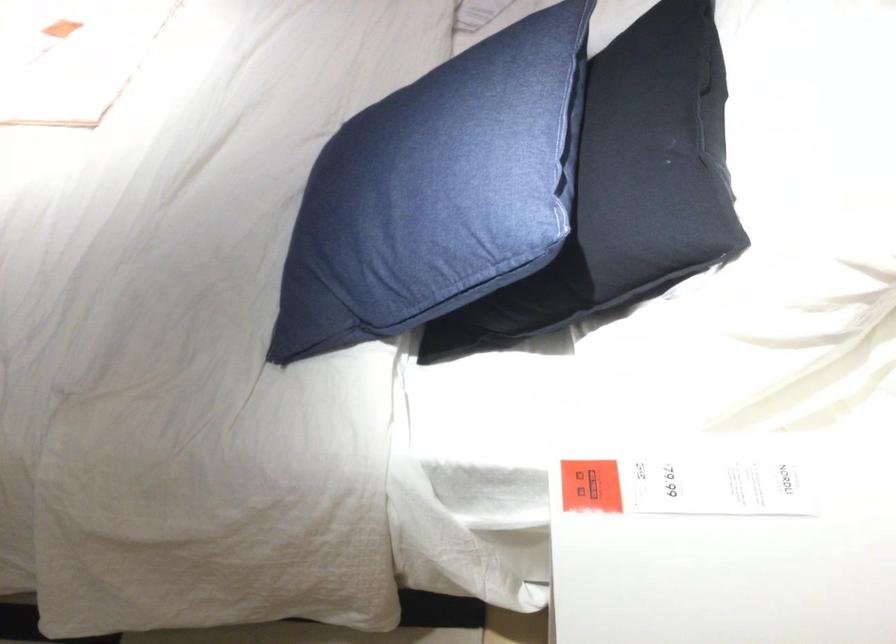
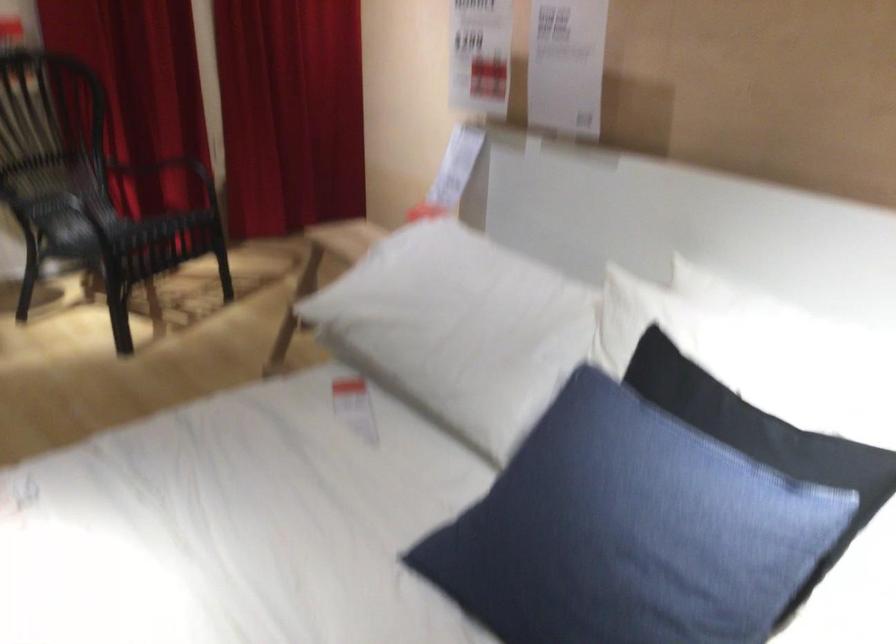
Locate, in the second image, the point that corresponds to pixel 408 176 in the first image.

(644, 536)